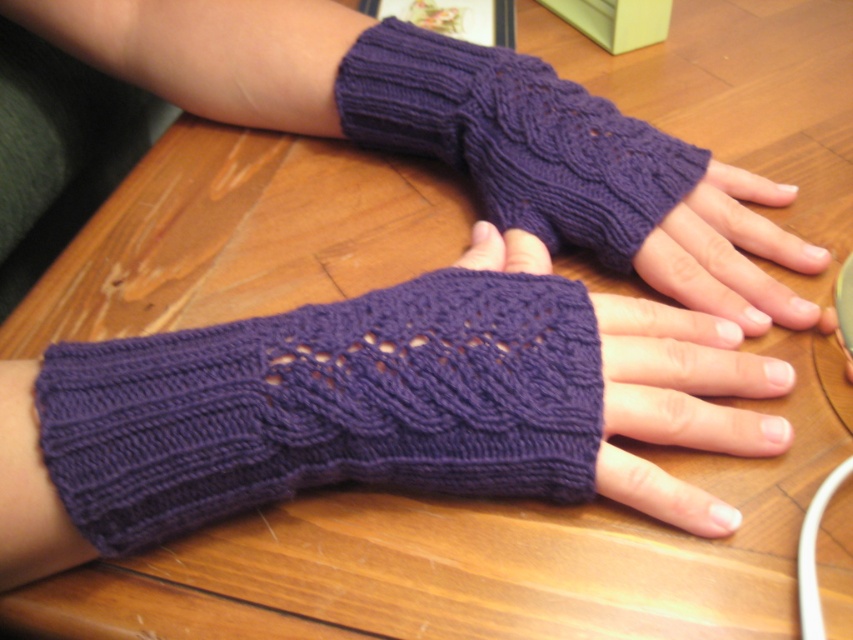
Question: Does purple knitted fingerless glove at center appear on the right side of purple knitted fingerless gloves at center?

Choices:
 (A) yes
 (B) no

Answer: (B)

Question: Can you confirm if purple knitted fingerless glove at center is positioned below matte purple fingerless gloves at center?

Choices:
 (A) no
 (B) yes

Answer: (B)

Question: Considering the real-world distances, which object is closest to the purple knitted fingerless gloves at center?

Choices:
 (A) matte purple fingerless gloves at center
 (B) purple knitted fingerless glove at center

Answer: (A)

Question: Which object is farther from the camera taking this photo?

Choices:
 (A) purple knitted fingerless glove at center
 (B) purple knitted fingerless gloves at center

Answer: (B)

Question: Among these points, which one is nearest to the camera?

Choices:
 (A) (589, 472)
 (B) (662, 248)

Answer: (A)

Question: Does purple knitted fingerless glove at center have a larger size compared to purple knitted fingerless gloves at center?

Choices:
 (A) no
 (B) yes

Answer: (B)